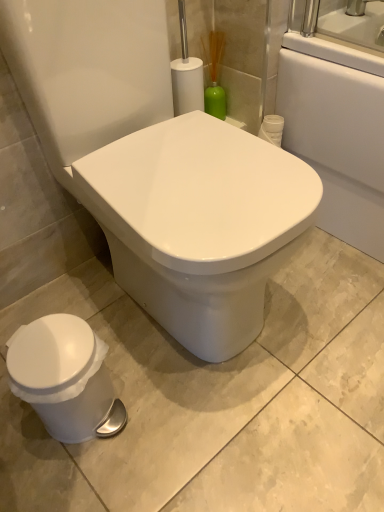
I want to click on white plastic trash can at lower left, so point(65,378).

Describe the element at coordinates (65, 378) in the screenshot. Image resolution: width=384 pixels, height=512 pixels. I see `white plastic trash can at lower left` at that location.

Image resolution: width=384 pixels, height=512 pixels. In order to click on white plastic trash can at lower left in this screenshot , I will do pyautogui.click(x=65, y=378).